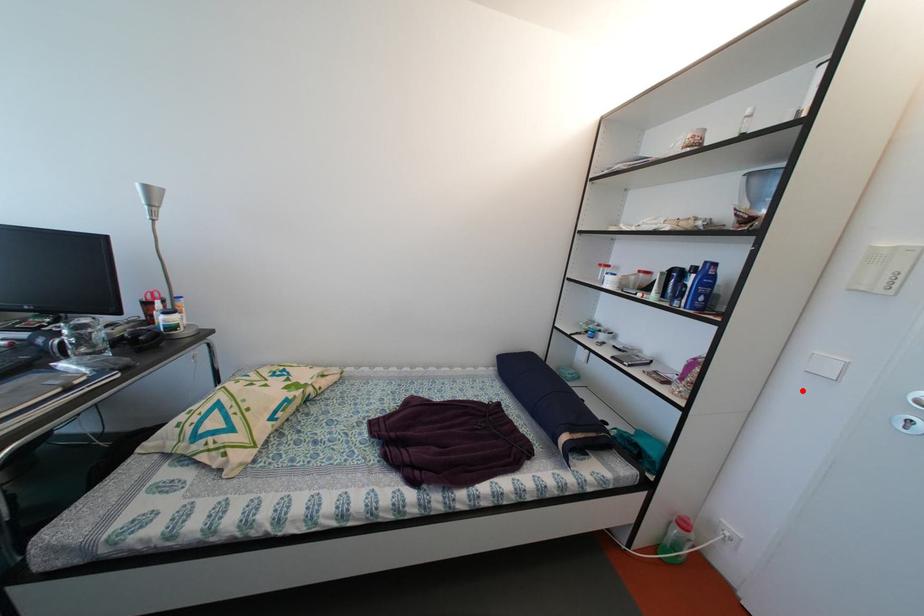
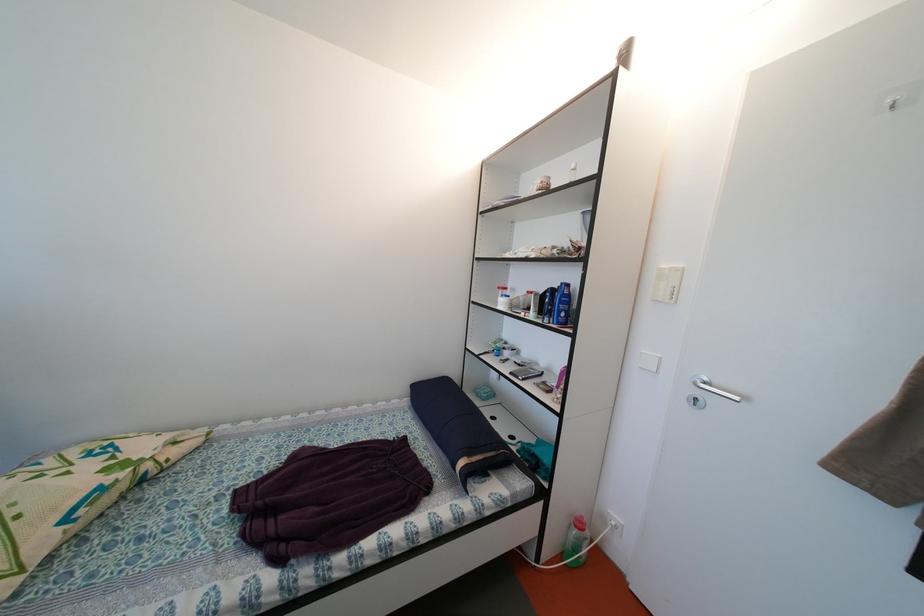
Question: I am providing you with two images of the same scene from different viewpoints. A red point is marked on the first image. Is the red point's position out of view in image 2?

Choices:
 (A) Yes
 (B) No

Answer: (B)